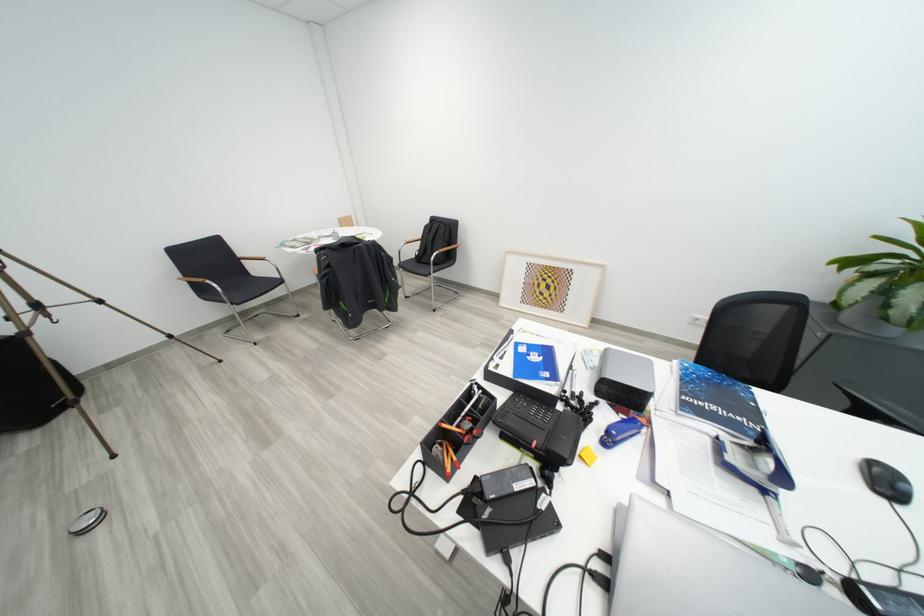
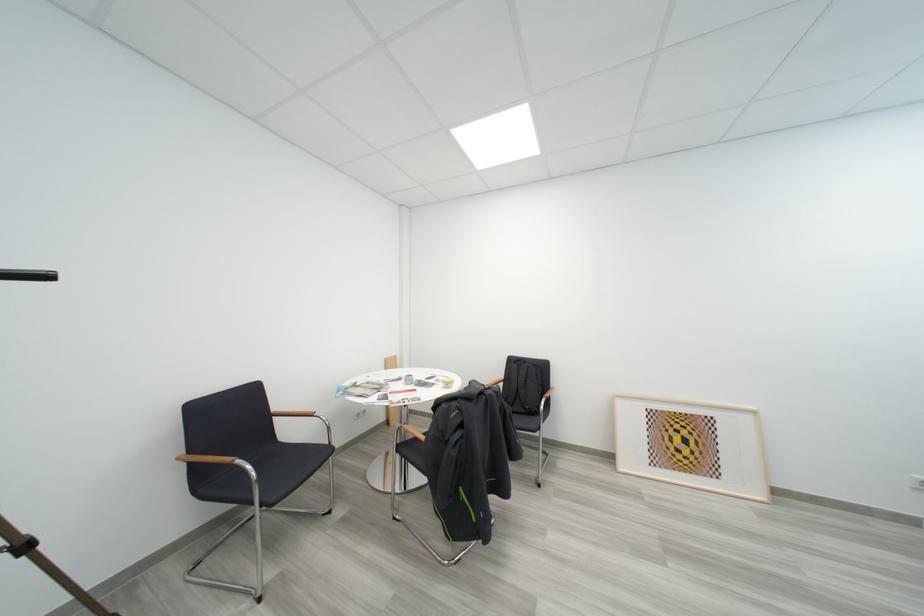
Where in the second image is the point corresponding to point 557,283 from the first image?

(693, 435)